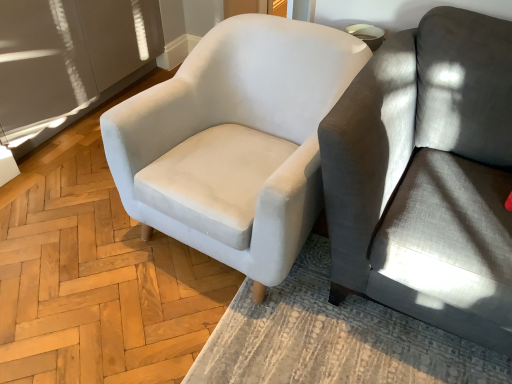
Question: Visually, is white fabric chair at center positioned to the left or to the right of gray fabric couch at right?

Choices:
 (A) left
 (B) right

Answer: (A)

Question: From the image's perspective, is white fabric chair at center above or below gray fabric couch at right?

Choices:
 (A) below
 (B) above

Answer: (B)

Question: Is point (263, 198) closer or farther from the camera than point (479, 142)?

Choices:
 (A) closer
 (B) farther

Answer: (A)

Question: From the image's perspective, is gray fabric couch at right positioned above or below white fabric chair at center?

Choices:
 (A) below
 (B) above

Answer: (A)

Question: Relative to white fabric chair at center, is gray fabric couch at right in front or behind?

Choices:
 (A) front
 (B) behind

Answer: (A)

Question: From a real-world perspective, is gray fabric couch at right physically located above or below white fabric chair at center?

Choices:
 (A) below
 (B) above

Answer: (B)

Question: In terms of height, does gray fabric couch at right look taller or shorter compared to white fabric chair at center?

Choices:
 (A) tall
 (B) short

Answer: (A)